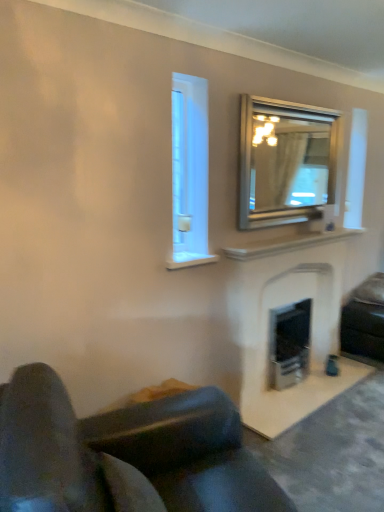
Question: Is leather couch at lower left, the 1th studio couch when ordered from front to back, in contact with white stone fireplace at center?

Choices:
 (A) no
 (B) yes

Answer: (A)

Question: Is leather couch at lower left, marked as the 2th studio couch in a right-to-left arrangement, shorter than white stone fireplace at center?

Choices:
 (A) no
 (B) yes

Answer: (B)

Question: Is the position of leather couch at lower left, positioned as the second studio couch in back-to-front order, less distant than that of white stone fireplace at center?

Choices:
 (A) yes
 (B) no

Answer: (A)

Question: Considering the relative positions of leather couch at lower left, marked as the 2th studio couch in a right-to-left arrangement, and white stone fireplace at center in the image provided, is leather couch at lower left, marked as the 2th studio couch in a right-to-left arrangement, to the right of white stone fireplace at center from the viewer's perspective?

Choices:
 (A) no
 (B) yes

Answer: (A)

Question: Does leather couch at lower left, the 1th studio couch when ordered from front to back, have a greater height compared to white stone fireplace at center?

Choices:
 (A) no
 (B) yes

Answer: (A)

Question: From a real-world perspective, is leather couch at lower left, marked as the 2th studio couch in a right-to-left arrangement, positioned under white stone fireplace at center based on gravity?

Choices:
 (A) no
 (B) yes

Answer: (B)

Question: Can you confirm if white marble fireplace at upper center is bigger than silver metallic mirror at upper right?

Choices:
 (A) yes
 (B) no

Answer: (B)

Question: From a real-world perspective, is white marble fireplace at upper center positioned over silver metallic mirror at upper right based on gravity?

Choices:
 (A) yes
 (B) no

Answer: (B)

Question: Would you say silver metallic mirror at upper right is part of white marble fireplace at upper center's contents?

Choices:
 (A) no
 (B) yes

Answer: (A)

Question: Does white marble fireplace at upper center have a lesser height compared to silver metallic mirror at upper right?

Choices:
 (A) yes
 (B) no

Answer: (A)

Question: Is white marble fireplace at upper center outside silver metallic mirror at upper right?

Choices:
 (A) no
 (B) yes

Answer: (B)

Question: Does white marble fireplace at upper center turn towards silver metallic mirror at upper right?

Choices:
 (A) no
 (B) yes

Answer: (A)

Question: Considering the relative sizes of black leather studio couch at lower right, acting as the first studio couch starting from the right, and white stone fireplace at center in the image provided, is black leather studio couch at lower right, acting as the first studio couch starting from the right, smaller than white stone fireplace at center?

Choices:
 (A) no
 (B) yes

Answer: (B)